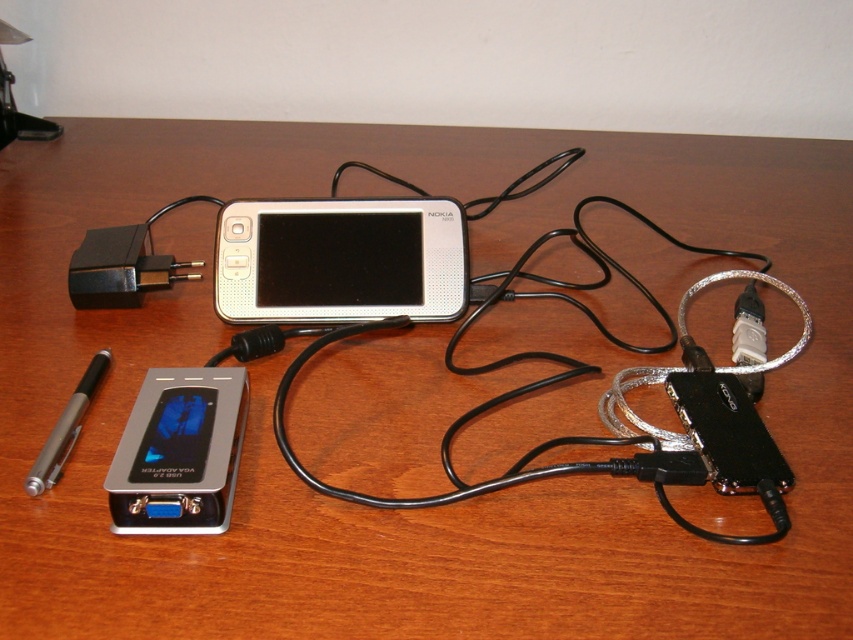
You are organizing a desk and need to place the silver metallic pen at lower left. The silver metallic nokia phone at center is currently in the way. Can you move the phone to make space?

The silver metallic nokia phone at center is positioned over the silver metallic pen at lower left, so moving the phone would allow access to the pen.